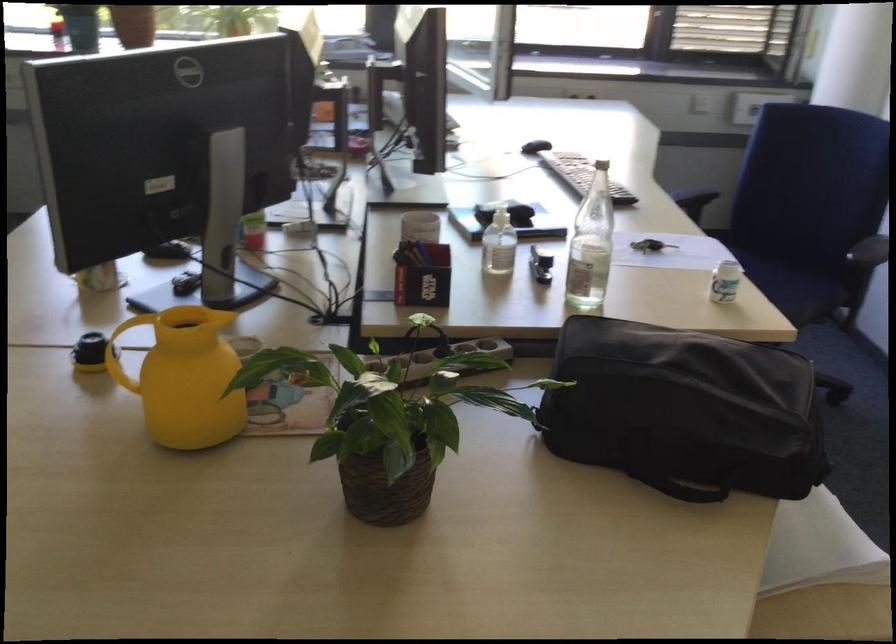
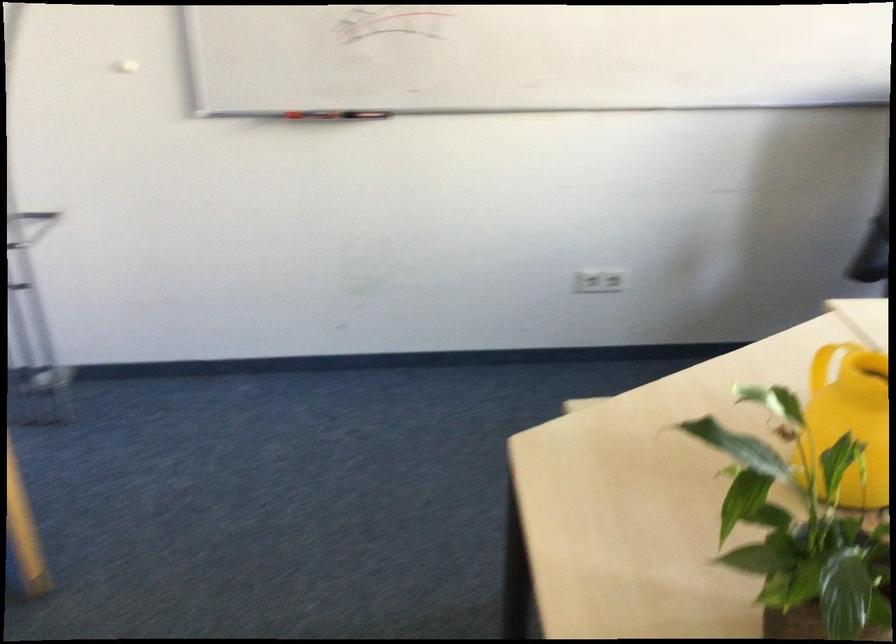
Locate, in the second image, the point that corresponds to (x=151, y=381) in the first image.

(849, 420)